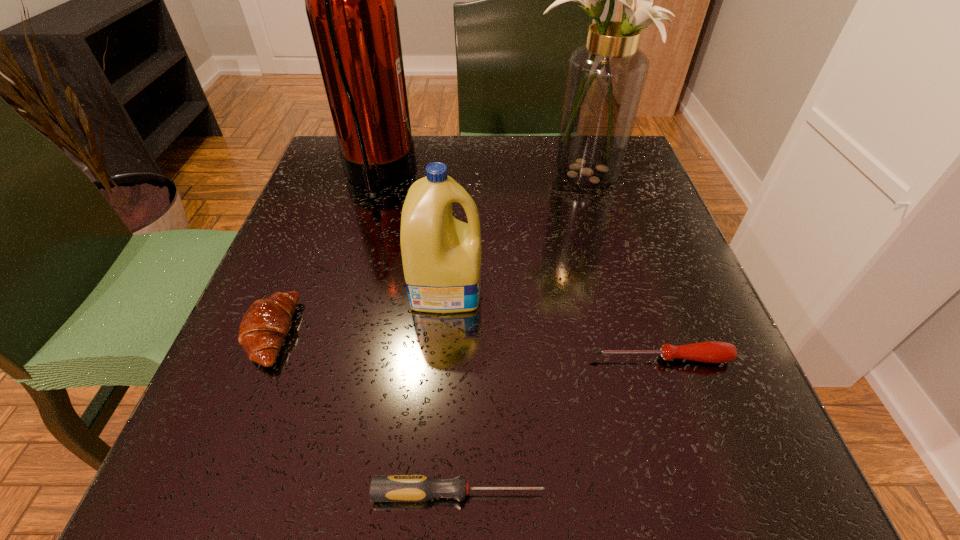
Locate an element on the screen. free space that is in between the fourth shortest object and the right screwdriver is located at coordinates (554, 322).

Find the location of a particular element. vacant area between the nearest object and the right screwdriver is located at coordinates (560, 426).

The height and width of the screenshot is (540, 960). In order to click on empty space between the flower arrangement and the fourth shortest object in this screenshot , I will do `click(514, 231)`.

Locate an element on the screen. This screenshot has width=960, height=540. free space that is in between the fifth shortest object and the farther screwdriver is located at coordinates (621, 267).

The image size is (960, 540). I want to click on free space between the farther screwdriver and the nearer screwdriver, so click(560, 426).

Find the location of a particular element. The width and height of the screenshot is (960, 540). free area in between the left screwdriver and the right screwdriver is located at coordinates pos(560,426).

In order to click on vacant point located between the crescent roll and the tallest object in this screenshot , I will do `click(324, 254)`.

Identify the location of object that is the fourth closest to the detergent. (605, 79).

Choose which object is the fifth nearest neighbor to the tallest object. Please provide its 2D coordinates. Your answer should be formatted as a tuple, i.e. [(x, y)], where the tuple contains the x and y coordinates of a point satisfying the conditions above.

[(383, 488)]

You are a GUI agent. You are given a task and a screenshot of the screen. Output one action in this format:
    pyautogui.click(x=<x>, y=<y>)
    Task: Click on the vacant space that satisfies the following two spatial constraints: 1. on the back side of the second tallest object; 2. on the left side of the third shortest object
    The height and width of the screenshot is (540, 960).
    Given the screenshot: What is the action you would take?
    pyautogui.click(x=334, y=177)